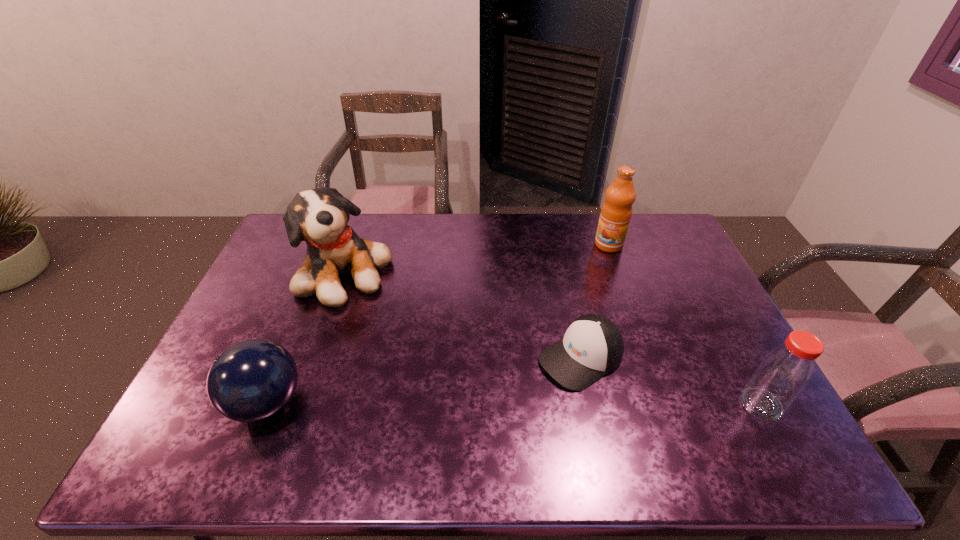
Locate an element on the screen. Image resolution: width=960 pixels, height=540 pixels. the second shortest object is located at coordinates [252, 380].

You are a GUI agent. You are given a task and a screenshot of the screen. Output one action in this format:
    pyautogui.click(x=<x>, y=<y>)
    Task: Click on the bottle
    Image resolution: width=960 pixels, height=540 pixels.
    Given the screenshot: What is the action you would take?
    pyautogui.click(x=783, y=374)

Locate an element on the screen. the rightmost object is located at coordinates (783, 374).

This screenshot has height=540, width=960. I want to click on cap, so click(592, 346).

Image resolution: width=960 pixels, height=540 pixels. I want to click on the shortest object, so click(x=592, y=346).

Find the location of a particular element. Image resolution: width=960 pixels, height=540 pixels. fruit juice is located at coordinates (616, 212).

Find the location of a particular element. The image size is (960, 540). puppy is located at coordinates (319, 217).

In order to click on vacant space situated on the surface of the second shortest object near the finger holes in this screenshot , I will do `click(204, 403)`.

At what (x,y) coordinates should I click in order to perform the action: click on free spot located on the surface of the second shortest object near the finger holes. Please return your answer as a coordinate pair (x, y). Looking at the image, I should click on coord(188,403).

At what (x,y) coordinates should I click in order to perform the action: click on vacant space situated on the back of the third tallest object. Please return your answer as a coordinate pair (x, y). This screenshot has width=960, height=540. Looking at the image, I should click on (743, 371).